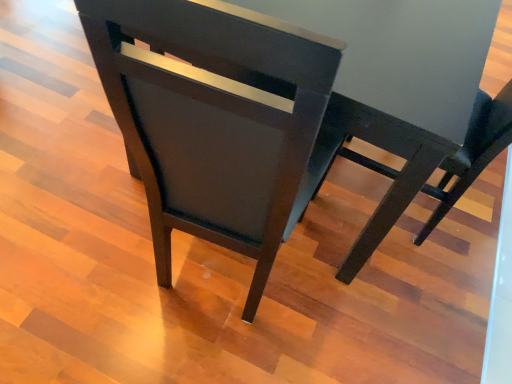
Question: Considering the positions of matte black table at center and matte dark wood chair at center in the image, is matte black table at center taller or shorter than matte dark wood chair at center?

Choices:
 (A) tall
 (B) short

Answer: (B)

Question: From the image's perspective, is matte black table at center located above or below matte dark wood chair at center?

Choices:
 (A) below
 (B) above

Answer: (B)

Question: From a real-world perspective, is matte black table at center positioned above or below matte dark wood chair at center?

Choices:
 (A) above
 (B) below

Answer: (B)

Question: Is matte dark wood chair at center wider or thinner than matte black table at center?

Choices:
 (A) thin
 (B) wide

Answer: (A)

Question: Would you say matte dark wood chair at center is to the left or to the right of matte black table at center in the picture?

Choices:
 (A) left
 (B) right

Answer: (A)

Question: Relative to matte black table at center, is matte dark wood chair at center in front or behind?

Choices:
 (A) front
 (B) behind

Answer: (A)

Question: From a real-world perspective, is matte dark wood chair at center above or below matte black table at center?

Choices:
 (A) below
 (B) above

Answer: (B)